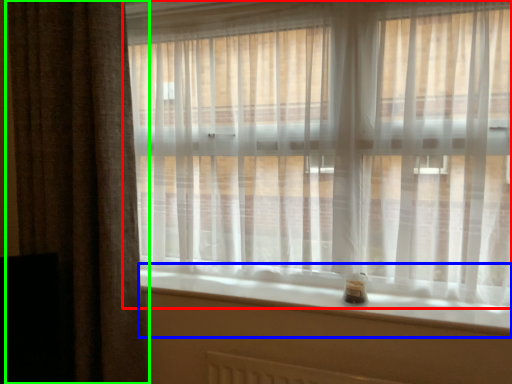
Question: Estimate the real-world distances between objects in this image. Which object is farther from curtain (highlighted by a red box), window sill (highlighted by a blue box) or curtain (highlighted by a green box)?

Choices:
 (A) window sill
 (B) curtain

Answer: (B)